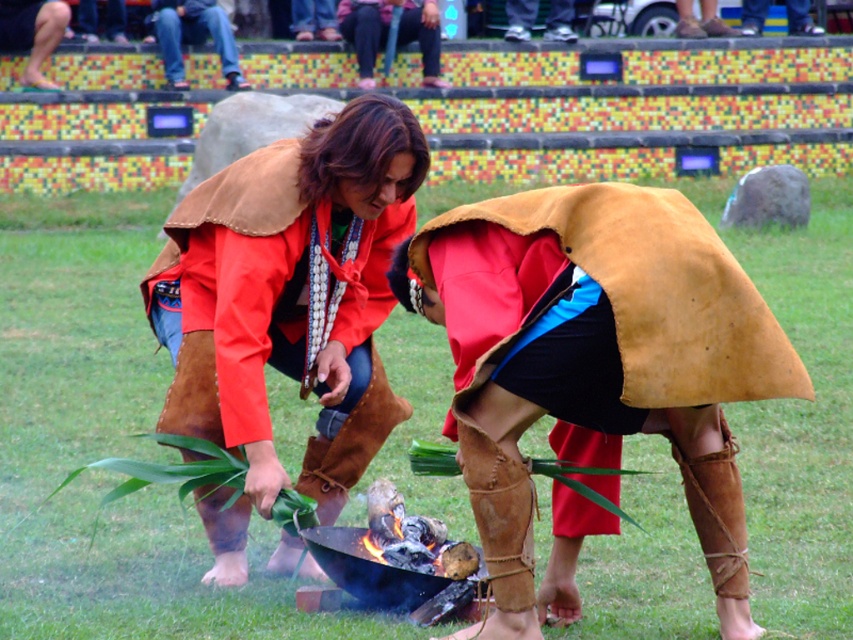
Based on the photo, you are a photographer standing at the edge of the grassy area where the two individuals are positioned. You need to capture a photo that includes both the matte red jacket at center and the blue sash around their waist. Given that your camera has a maximum focus range of 7 meters, will you be able to capture both subjects in focus without moving closer?

The two individuals are 6.95 meters apart. Since the camera can focus up to 7 meters, the distance between them is within the focus range. Therefore, you can capture both the matte red jacket at center and the blue sash around their waist in focus without moving closer.

Based on the photo, you are an archaeologist examining a historical site. You notice an object labeled as the brown leather trench coat at center. Based on its coordinates, can you determine its exact location relative to the backdrop?

The brown leather trench coat at center is located at coordinates point (595, 368), which places it near the center of the image, slightly to the right and lower middle area relative to the backdrop.